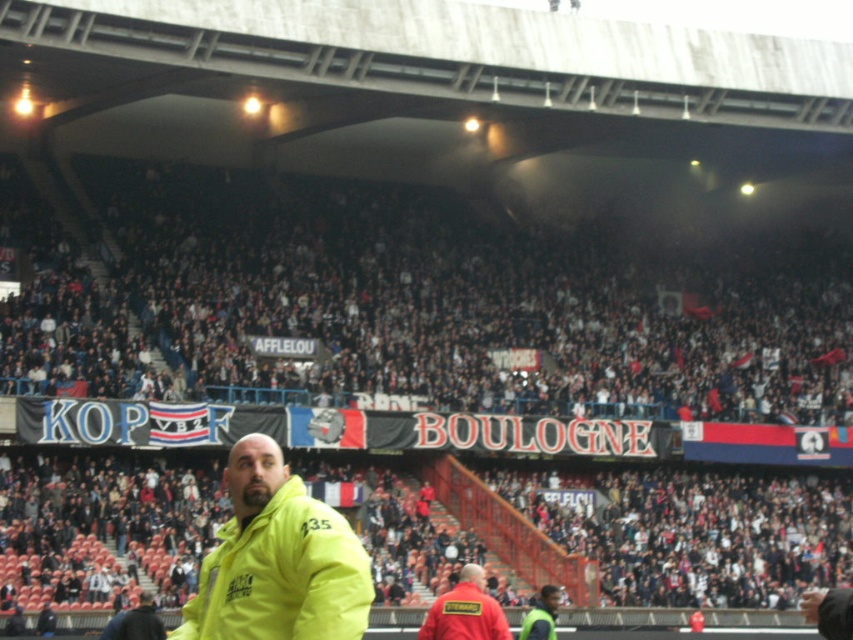
Question: Among these points, which one is nearest to the camera?

Choices:
 (A) (318, 605)
 (B) (143, 628)
 (C) (498, 628)
 (D) (543, 604)

Answer: (A)

Question: Is yellow matte jacket at center above yellow jacket at lower center?

Choices:
 (A) yes
 (B) no

Answer: (A)

Question: Is red fabric steward at lower center positioned before yellow jacket at center?

Choices:
 (A) yes
 (B) no

Answer: (A)

Question: Which point is farther from the camera taking this photo?

Choices:
 (A) (119, 612)
 (B) (318, 516)

Answer: (A)

Question: Among these objects, which one is nearest to the camera?

Choices:
 (A) yellow jacket at lower center
 (B) yellow jacket at center

Answer: (A)

Question: Can you confirm if yellow matte jacket at center is bigger than yellow jacket at center?

Choices:
 (A) yes
 (B) no

Answer: (A)